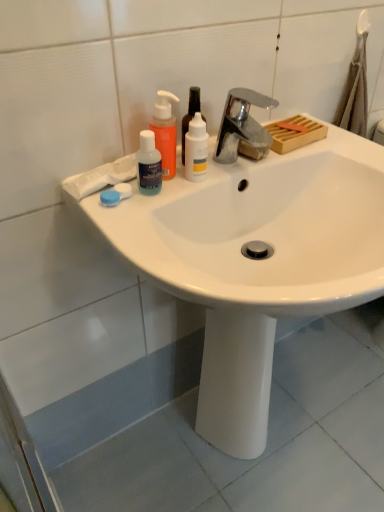
In order to click on vacant point to the right of translucent plastic mouthwash at upper left, arranged as the first mouthwash when viewed from the left in this screenshot , I will do `click(214, 178)`.